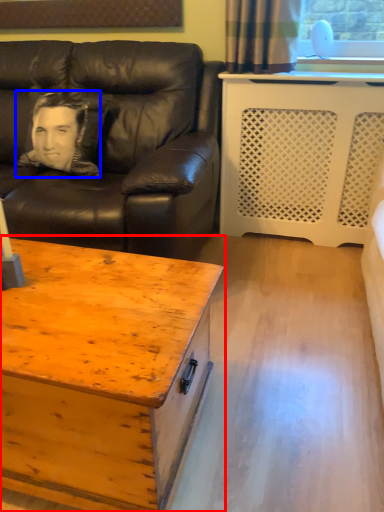
Question: Which object appears closest to the camera in this image, coffee table (highlighted by a red box) or man (highlighted by a blue box)?

Choices:
 (A) coffee table
 (B) man

Answer: (A)